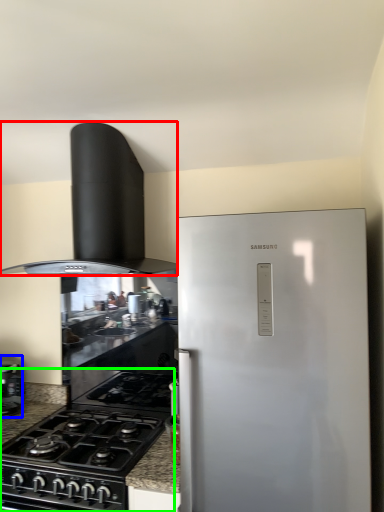
Question: Estimate the real-world distances between objects in this image. Which object is farther from home appliance (highlighted by a red box), kitchen appliance (highlighted by a blue box) or gas stove (highlighted by a green box)?

Choices:
 (A) kitchen appliance
 (B) gas stove

Answer: (A)